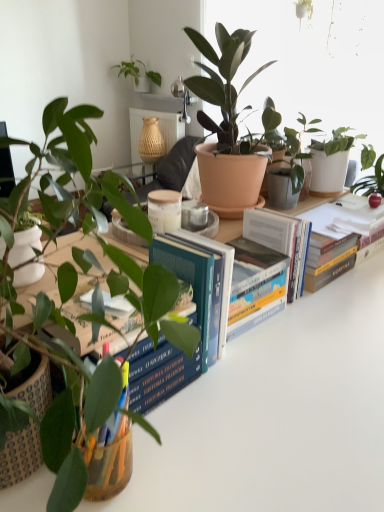
Describe the element at coordinates (196, 314) in the screenshot. I see `blue hardcover book at center` at that location.

Locate an element on the screen. The image size is (384, 512). blue hardcover book at center is located at coordinates tap(196, 314).

The image size is (384, 512). Find the location of `white glossy table at center`. white glossy table at center is located at coordinates (278, 414).

Describe the element at coordinates (278, 414) in the screenshot. I see `white glossy table at center` at that location.

Identify the location of blue hardcover book at center. (196, 314).

Is white glossy table at center to the left or to the right of blue hardcover book at center in the image?

white glossy table at center is positioned on blue hardcover book at center's right side.

Which object is further away from the camera, white glossy table at center or blue hardcover book at center?

blue hardcover book at center is further away from the camera.

Considering the positions of point (228, 409) and point (201, 244), is point (228, 409) closer or farther from the camera than point (201, 244)?

Point (228, 409) is positioned closer to the camera compared to point (201, 244).

From the image's perspective, relative to blue hardcover book at center, is white glossy table at center above or below?

white glossy table at center is situated lower than blue hardcover book at center in the image.

From a real-world perspective, is white glossy table at center positioned over blue hardcover book at center based on gravity?

No, from a real-world perspective, white glossy table at center is not over blue hardcover book at center

Between white glossy table at center and blue hardcover book at center, which one has larger width?

Wider between the two is white glossy table at center.

Between white glossy table at center and blue hardcover book at center, which one has more height?

white glossy table at center is taller.

Considering the relative sizes of white glossy table at center and blue hardcover book at center in the image provided, is white glossy table at center smaller than blue hardcover book at center?

No, white glossy table at center is not smaller than blue hardcover book at center.

Is white glossy table at center surrounding blue hardcover book at center?

No, blue hardcover book at center is not inside white glossy table at center.

Are white glossy table at center and blue hardcover book at center making contact?

white glossy table at center and blue hardcover book at center are clearly separated.

Is white glossy table at center facing away from blue hardcover book at center?

white glossy table at center is not turned away from blue hardcover book at center.

What's the angular difference between white glossy table at center and blue hardcover book at center's facing directions?

The angle between the facing direction of white glossy table at center and the facing direction of blue hardcover book at center is 1.92 degrees.

How distant is white glossy table at center from blue hardcover book at center?

6.53 inches.

The height and width of the screenshot is (512, 384). Find the location of `table below the blue hardcover book at center (from a real-world perspective)`. table below the blue hardcover book at center (from a real-world perspective) is located at coordinates (278, 414).

From the picture: Between blue hardcover book at center and white glossy table at center, which one appears on the left side from the viewer's perspective?

Positioned to the left is blue hardcover book at center.

Is blue hardcover book at center positioned in front of white glossy table at center?

No, blue hardcover book at center is behind white glossy table at center.

Which is closer, (169, 260) or (159, 431)?

The point (159, 431) is more forward.

From the image's perspective, is blue hardcover book at center above or below white glossy table at center?

From the image's perspective, blue hardcover book at center appears above white glossy table at center.

From a real-world perspective, is blue hardcover book at center physically above white glossy table at center?

Indeed, from a real-world perspective, blue hardcover book at center stands above white glossy table at center.

Does blue hardcover book at center have a lesser width compared to white glossy table at center?

Yes, blue hardcover book at center is thinner than white glossy table at center.

Between blue hardcover book at center and white glossy table at center, which one has less height?

blue hardcover book at center is shorter.

Can you confirm if blue hardcover book at center is bigger than white glossy table at center?

Incorrect, blue hardcover book at center is not larger than white glossy table at center.

Would you say blue hardcover book at center is outside white glossy table at center?

Yes, blue hardcover book at center is located beyond the bounds of white glossy table at center.

Based on the photo, is blue hardcover book at center positioned far away from white glossy table at center?

That's not correct — blue hardcover book at center is a little close to white glossy table at center.

Consider the image. Is blue hardcover book at center turned away from white glossy table at center?

No, blue hardcover book at center's orientation is not away from white glossy table at center.

Consider the image. How different are the orientations of blue hardcover book at center and white glossy table at center in degrees?

The angular difference between blue hardcover book at center and white glossy table at center is 1.92 degrees.

Locate an element on the screen. Image resolution: width=384 pixels, height=512 pixels. paperback book above the white glossy table at center (from a real-world perspective) is located at coordinates (196, 314).

The height and width of the screenshot is (512, 384). I want to click on paperback book above the white glossy table at center (from the image's perspective), so click(196, 314).

Where is `paperback book that is behind the white glossy table at center`? The width and height of the screenshot is (384, 512). paperback book that is behind the white glossy table at center is located at coordinates (196, 314).